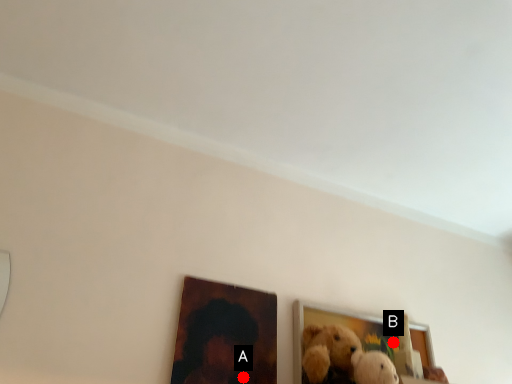
Question: Two points are circled on the image, labeled by A and B beside each circle. Which point is further to the camera?

Choices:
 (A) A is further
 (B) B is further

Answer: (B)